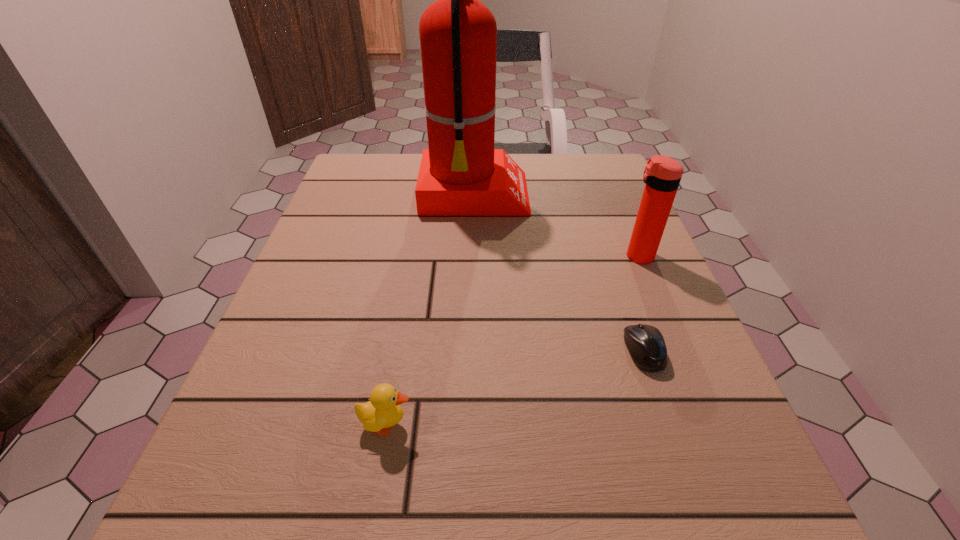
Find the location of a particular element. vacant space situated 0.350m on the front-facing side of the nearest object is located at coordinates (657, 424).

Where is `vacant position located on the left of the shortest object`? The image size is (960, 540). vacant position located on the left of the shortest object is located at coordinates (511, 351).

Where is `object that is at the far edge`? This screenshot has width=960, height=540. object that is at the far edge is located at coordinates (461, 174).

Locate an element on the screen. thermos bottle that is positioned at the right edge is located at coordinates (662, 175).

The height and width of the screenshot is (540, 960). In order to click on mouse situated at the right edge in this screenshot , I will do `click(646, 345)`.

Where is `vacant region at the far edge of the desktop`? vacant region at the far edge of the desktop is located at coordinates (537, 166).

I want to click on vacant space at the near edge, so click(x=365, y=523).

This screenshot has width=960, height=540. I want to click on vacant space at the left edge of the desktop, so click(321, 325).

At what (x,y) coordinates should I click in order to perform the action: click on free point at the right edge. Please return your answer as a coordinate pair (x, y). The width and height of the screenshot is (960, 540). Looking at the image, I should click on (664, 476).

In order to click on free location at the far left corner in this screenshot , I will do `click(353, 173)`.